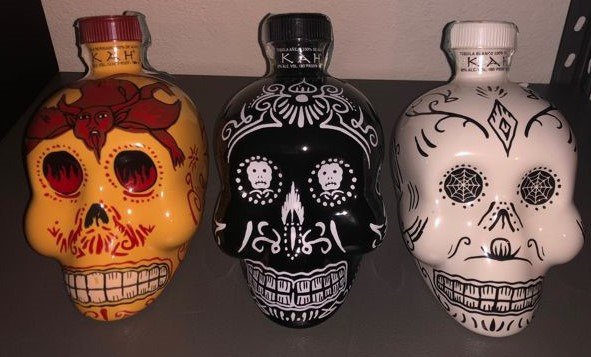
The width and height of the screenshot is (591, 357). I want to click on metal bracket, so click(571, 46).